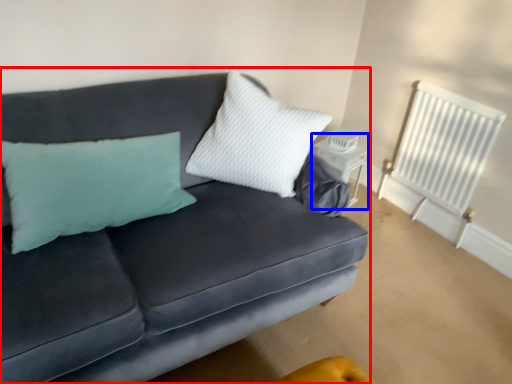
Question: Which object is closer to the camera taking this photo, studio couch (highlighted by a red box) or table (highlighted by a blue box)?

Choices:
 (A) studio couch
 (B) table

Answer: (A)